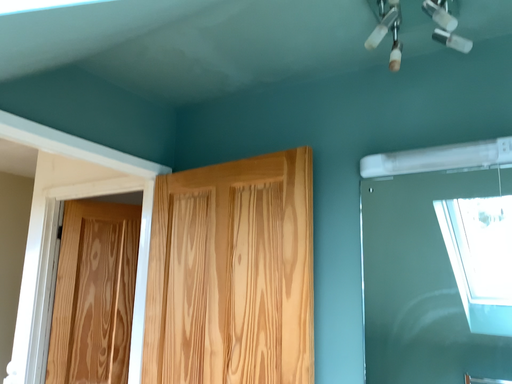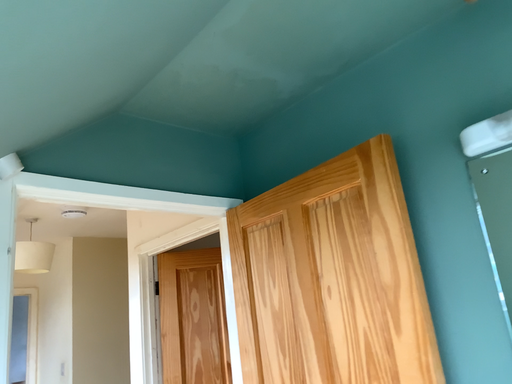
Question: How did the camera likely rotate when shooting the video?

Choices:
 (A) rotated right
 (B) rotated left

Answer: (B)